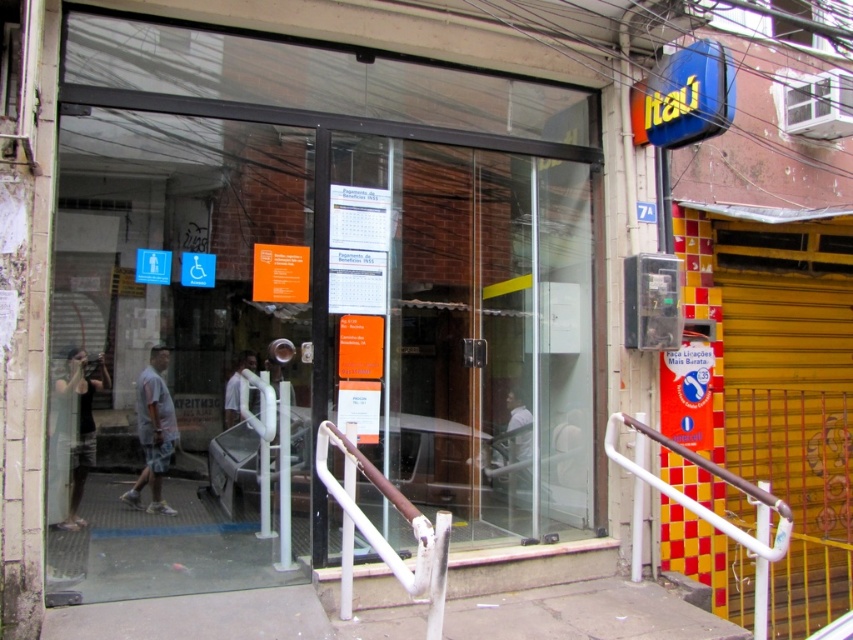
You are standing at the entrance of the bank and need to locate two specific points marked on the wall. The first point is at coordinates point (749, 493) and the second is at point (68, 524). From your current position, which point is closer to you?

Point (749, 493) is in front of point (68, 524), so it is closer to you.

You are designing a new accessibility ramp for the entrance of this commercial establishment. You need to ensure that the white metal handrail at lower right and the matte black shirt at left are both visible to users. Considering their widths, which object should be placed closer to the user for better visibility?

The white metal handrail at lower right has a lesser width compared to the matte black shirt at left. To ensure better visibility, the narrower white metal handrail at lower right should be placed closer to the user so that it can be easily seen and accessed.